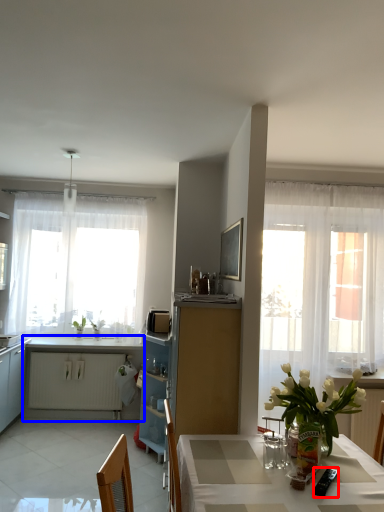
Question: Which of the following is the closest to the observer, appliance (highlighted by a red box) or cabinetry (highlighted by a blue box)?

Choices:
 (A) appliance
 (B) cabinetry

Answer: (A)